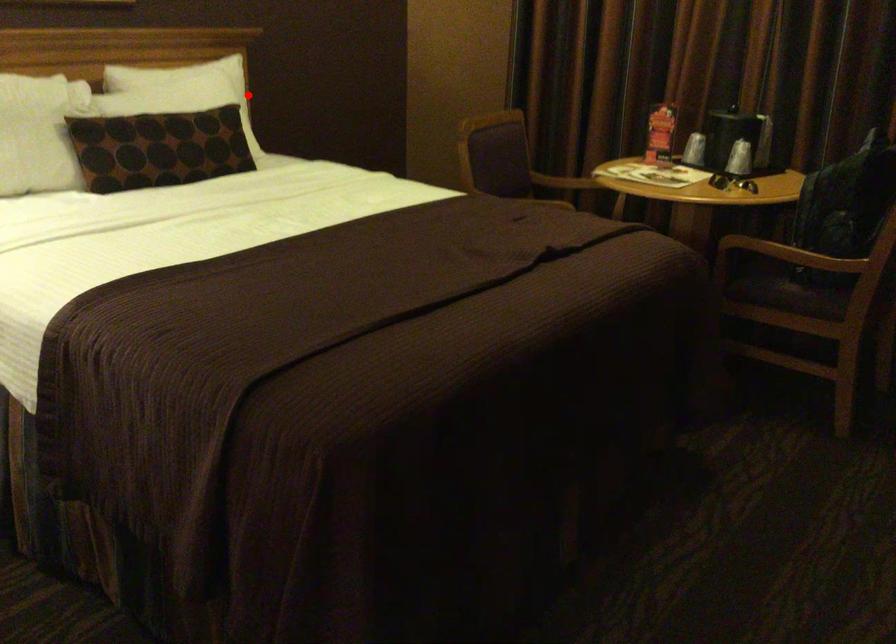
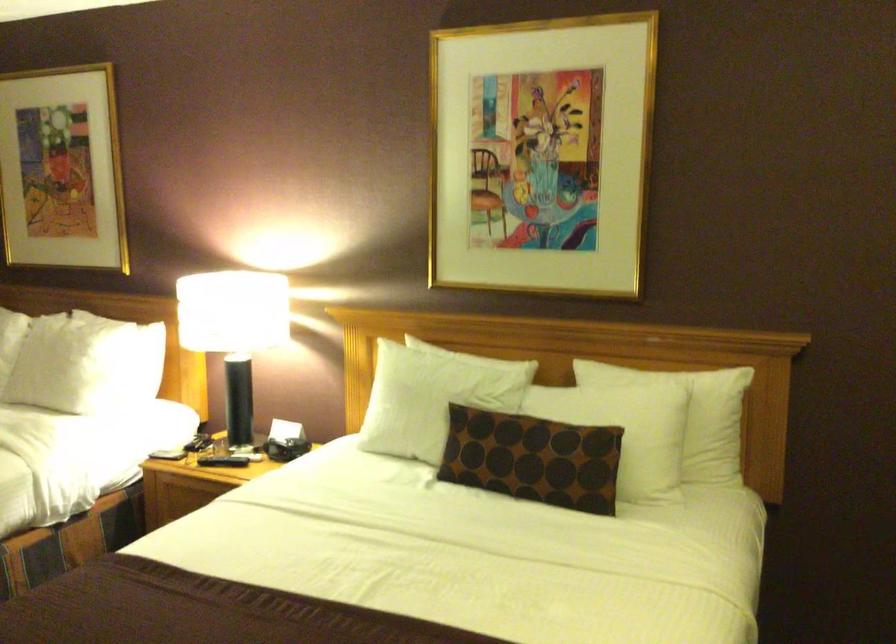
Locate, in the second image, the point that corresponds to the highlighted location in the first image.

(709, 422)